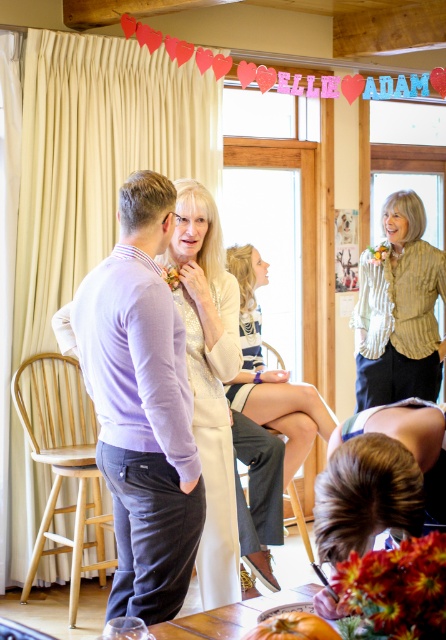
Can you confirm if white textured dress at center is positioned below white striped dress at center?

Yes.

In order to click on white textured dress at center in this screenshot , I will do `click(209, 378)`.

Where is `white textured dress at center`? This screenshot has width=446, height=640. white textured dress at center is located at coordinates (209, 378).

Can you confirm if purple sweater at center is bigger than purple fabric shirt at left?

Yes, purple sweater at center is bigger than purple fabric shirt at left.

Measure the distance from purple sweater at center to purple fabric shirt at left.

They are 20.30 inches apart.

Which is behind, point (191, 522) or point (184, 179)?

The point (184, 179) is more distant.

Locate an element on the screen. purple sweater at center is located at coordinates (143, 406).

Does purple fabric shirt at left have a larger size compared to white striped dress at center?

Actually, purple fabric shirt at left might be smaller than white striped dress at center.

Can you confirm if purple fabric shirt at left is positioned below white striped dress at center?

Yes.

Is point (206, 573) positioned behind point (290, 406)?

No, (206, 573) is in front of (290, 406).

This screenshot has height=640, width=446. Identify the location of purple fabric shirt at left. (211, 365).